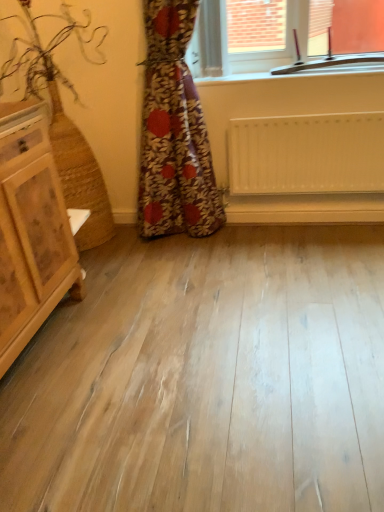
The height and width of the screenshot is (512, 384). I want to click on blank space above white matte radiator at center (from a real-world perspective), so click(x=332, y=111).